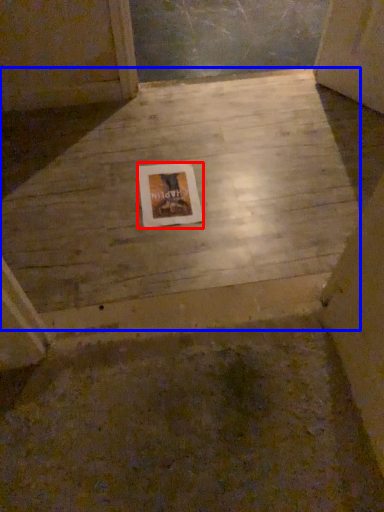
Question: Which of the following is the farthest to the observer, picture frame (highlighted by a red box) or concrete (highlighted by a blue box)?

Choices:
 (A) picture frame
 (B) concrete

Answer: (A)